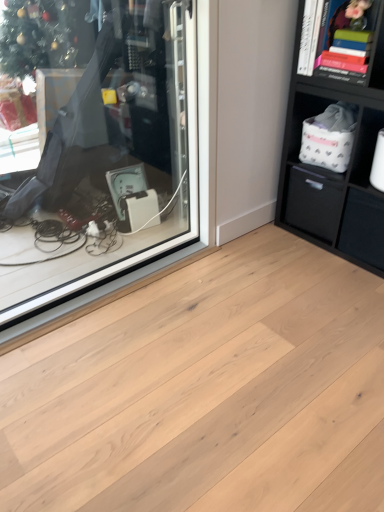
Question: From a real-world perspective, does natural wood plank at center sit lower than white fabric basket at right, which appears as the 1th cabinet when ordered from the bottom?

Choices:
 (A) no
 (B) yes

Answer: (B)

Question: Is natural wood plank at center turned away from white fabric basket at right, which is counted as the first cabinet, starting from the right?

Choices:
 (A) no
 (B) yes

Answer: (A)

Question: From a real-world perspective, is natural wood plank at center on white fabric basket at right, which appears as the 1th cabinet when ordered from the bottom?

Choices:
 (A) yes
 (B) no

Answer: (B)

Question: Can you confirm if natural wood plank at center is thinner than white fabric basket at right, which appears as the 1th cabinet when ordered from the bottom?

Choices:
 (A) yes
 (B) no

Answer: (B)

Question: Considering the relative sizes of natural wood plank at center and white fabric basket at right, which appears as the 1th cabinet when ordered from the bottom, in the image provided, is natural wood plank at center wider than white fabric basket at right, which appears as the 1th cabinet when ordered from the bottom,?

Choices:
 (A) no
 (B) yes

Answer: (B)

Question: Can you confirm if natural wood plank at center is bigger than white fabric basket at right, which is counted as the first cabinet, starting from the right?

Choices:
 (A) yes
 (B) no

Answer: (A)

Question: Are white fabric basket at right, the second cabinet from the left, and transparent glass shop window at upper left far apart?

Choices:
 (A) no
 (B) yes

Answer: (B)

Question: Is white fabric basket at right, the second cabinet from the left, facing away from transparent glass shop window at upper left?

Choices:
 (A) no
 (B) yes

Answer: (A)

Question: Does white fabric basket at right, the second cabinet from the left, touch transparent glass shop window at upper left?

Choices:
 (A) yes
 (B) no

Answer: (B)

Question: Does white fabric basket at right, which appears as the 1th cabinet when ordered from the bottom, have a greater width compared to transparent glass shop window at upper left?

Choices:
 (A) yes
 (B) no

Answer: (A)

Question: Is white fabric basket at right, which is the second cabinet from top to bottom, not inside transparent glass shop window at upper left?

Choices:
 (A) no
 (B) yes

Answer: (B)

Question: Could transparent glass shop window at upper left be considered to be inside white fabric basket at right, the second cabinet from the left?

Choices:
 (A) no
 (B) yes

Answer: (A)

Question: Is transparent glass shop window at upper left outside of matte black drawer at lower right, the 1th drawer from the right?

Choices:
 (A) no
 (B) yes

Answer: (B)